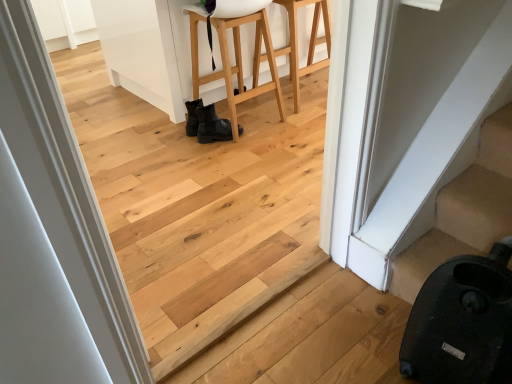
Question: From the image's perspective, is white smooth door at left above black matte boots at center?

Choices:
 (A) no
 (B) yes

Answer: (A)

Question: Considering the relative sizes of white smooth door at left and black matte boots at center in the image provided, is white smooth door at left shorter than black matte boots at center?

Choices:
 (A) no
 (B) yes

Answer: (A)

Question: From the image's perspective, is white smooth door at left beneath black matte boots at center?

Choices:
 (A) yes
 (B) no

Answer: (A)

Question: Considering the relative positions of white smooth door at left and black matte boots at center in the image provided, is white smooth door at left to the right of black matte boots at center from the viewer's perspective?

Choices:
 (A) no
 (B) yes

Answer: (A)

Question: Are white smooth door at left and black matte boots at center far apart?

Choices:
 (A) no
 (B) yes

Answer: (B)

Question: Would you say white smooth door at left is to the left or to the right of black matte boots at center in the picture?

Choices:
 (A) left
 (B) right

Answer: (A)

Question: Which is correct: white smooth door at left is inside black matte boots at center, or outside of it?

Choices:
 (A) inside
 (B) outside

Answer: (B)

Question: From a real-world perspective, is white smooth door at left above or below black matte boots at center?

Choices:
 (A) above
 (B) below

Answer: (A)

Question: From the image's perspective, is white smooth door at left above or below black matte boots at center?

Choices:
 (A) above
 (B) below

Answer: (B)

Question: Is black matte boots at center taller or shorter than white smooth door at left?

Choices:
 (A) short
 (B) tall

Answer: (A)

Question: Is black matte boots at center bigger or smaller than white smooth door at left?

Choices:
 (A) big
 (B) small

Answer: (B)

Question: In terms of width, does black matte boots at center look wider or thinner when compared to white smooth door at left?

Choices:
 (A) thin
 (B) wide

Answer: (B)

Question: From a real-world perspective, is black matte boots at center above or below white smooth door at left?

Choices:
 (A) above
 (B) below

Answer: (B)

Question: Is black matte boots at center bigger or smaller than black leather boots at center, the 1th furniture when ordered from left to right?

Choices:
 (A) small
 (B) big

Answer: (A)

Question: In terms of height, does black matte boots at center look taller or shorter compared to black leather boots at center, the 1th furniture when ordered from left to right?

Choices:
 (A) short
 (B) tall

Answer: (A)